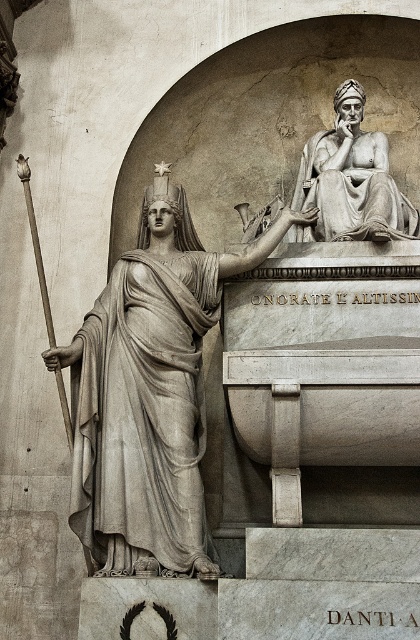
Does matte gray statue at upper right appear over wooden spear at left?

Yes.

Does matte gray statue at upper right appear on the right side of wooden spear at left?

Indeed, matte gray statue at upper right is positioned on the right side of wooden spear at left.

At what (x,y) coordinates should I click in order to perform the action: click on matte gray statue at upper right. Please return your answer as a coordinate pair (x, y). This screenshot has width=420, height=640. Looking at the image, I should click on (351, 180).

Does gray stone statue at left have a greater width compared to matte gray statue at upper right?

Yes, gray stone statue at left is wider than matte gray statue at upper right.

Does gray stone statue at left appear on the right side of matte gray statue at upper right?

In fact, gray stone statue at left is to the left of matte gray statue at upper right.

The width and height of the screenshot is (420, 640). Describe the element at coordinates (149, 392) in the screenshot. I see `gray stone statue at left` at that location.

Locate an element on the screen. gray stone statue at left is located at coordinates (149, 392).

Looking at this image, is gray stone statue at left positioned at the back of wooden spear at left?

No, it is not.

Can you confirm if gray stone statue at left is positioned to the right of wooden spear at left?

Yes, gray stone statue at left is to the right of wooden spear at left.

Is point (96, 445) less distant than point (34, 221)?

Yes.

In order to click on gray stone statue at left in this screenshot , I will do pyautogui.click(x=149, y=392).